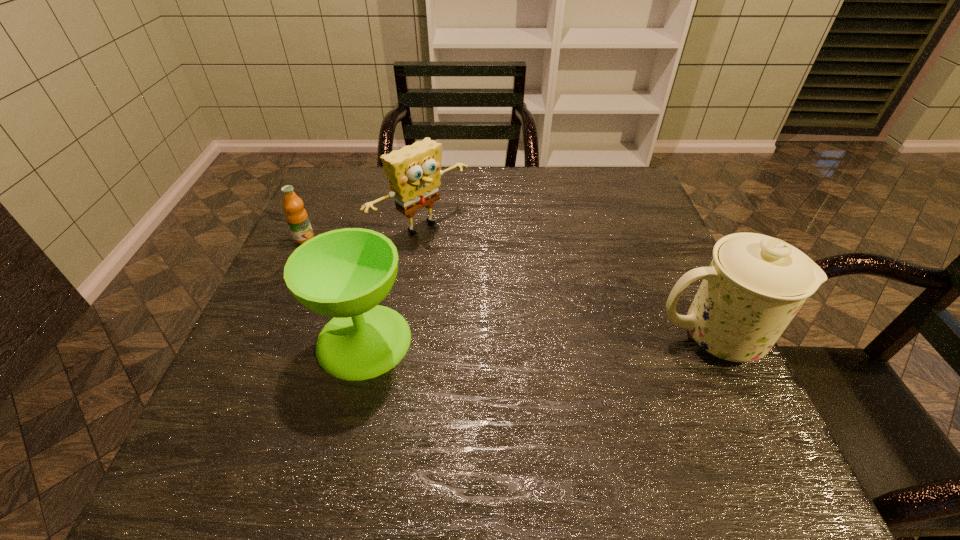
Where is `vacant space on the desktop that is between the wineglass and the rightmost object and is positioned on the label of the shortest object`? vacant space on the desktop that is between the wineglass and the rightmost object and is positioned on the label of the shortest object is located at coordinates coord(515,340).

Identify the location of vacant space on the desktop that is between the wineglass and the rightmost object and is positioned on the face of the sponge. coord(571,339).